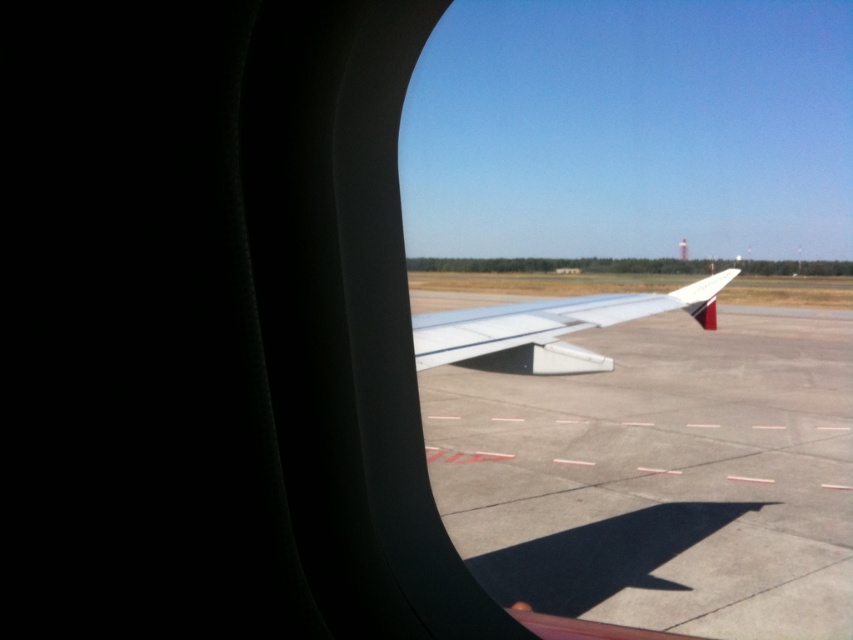
Question: Can you confirm if smooth concrete tarmac at center is thinner than white matte wing at center?

Choices:
 (A) yes
 (B) no

Answer: (B)

Question: Which object appears closest to the camera in this image?

Choices:
 (A) smooth concrete tarmac at center
 (B) white matte wing at center

Answer: (A)

Question: Can you confirm if smooth concrete tarmac at center is smaller than white matte wing at center?

Choices:
 (A) yes
 (B) no

Answer: (B)

Question: Which point is farther to the camera?

Choices:
 (A) smooth concrete tarmac at center
 (B) white matte wing at center

Answer: (B)

Question: Can you confirm if smooth concrete tarmac at center is thinner than white matte wing at center?

Choices:
 (A) yes
 (B) no

Answer: (B)